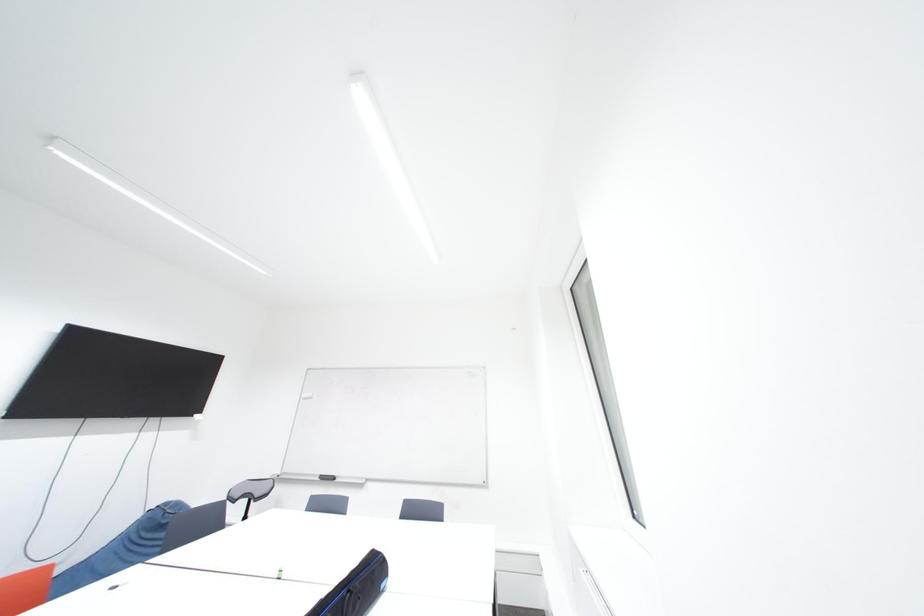
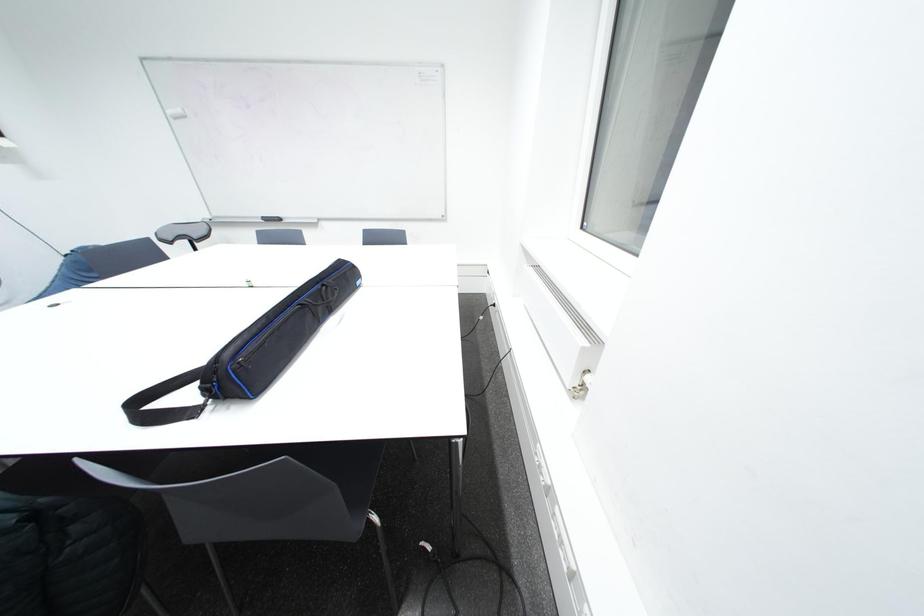
Question: Based on the continuous images, in which direction is the camera rotating? Reply with the corresponding letter.

Choices:
 (A) Left
 (B) Right
 (C) Up
 (D) Down

Answer: (D)